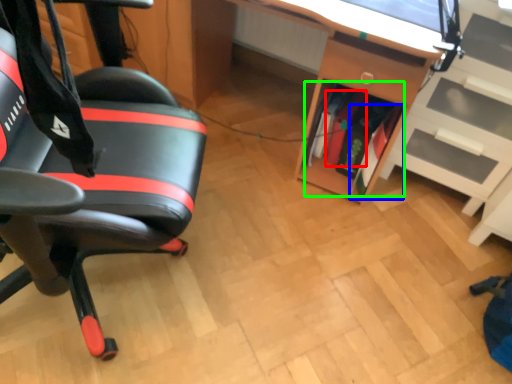
Question: Considering the real-world distances, which object is farthest from book (highlighted by a red box)? book (highlighted by a blue box) or book (highlighted by a green box)?

Choices:
 (A) book
 (B) book

Answer: (A)